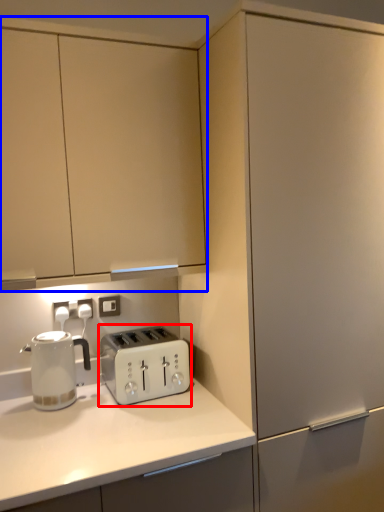
Question: Which object is further to the camera taking this photo, toaster (highlighted by a red box) or cabinetry (highlighted by a blue box)?

Choices:
 (A) toaster
 (B) cabinetry

Answer: (A)